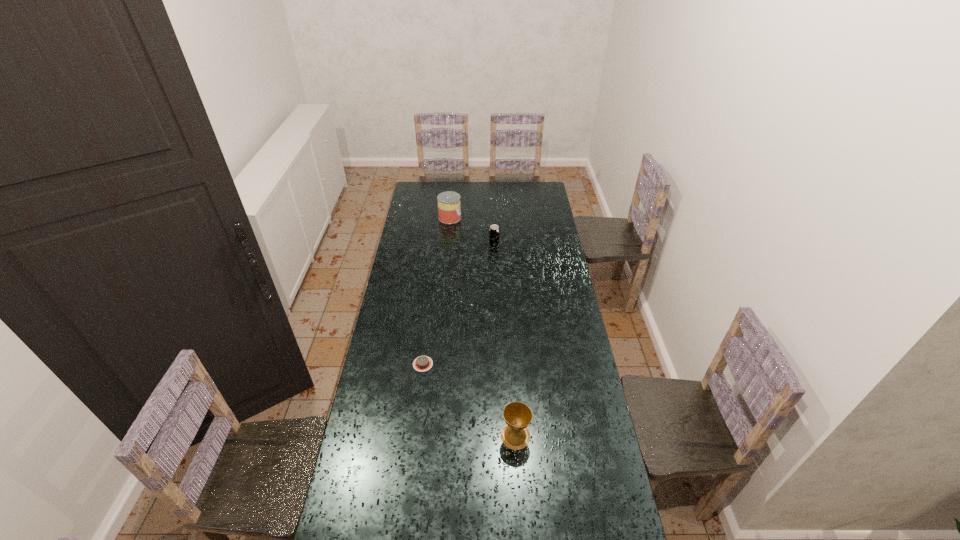
In the image, there is a desktop. What are the coordinates of `vacant space at the left edge` in the screenshot? It's located at (360, 524).

I want to click on free point at the right edge, so click(x=551, y=370).

What are the coordinates of `free space at the far right corner` in the screenshot? It's located at (529, 183).

At what (x,y) coordinates should I click in order to perform the action: click on blank region between the can and the chocolate cake. Please return your answer as a coordinate pair (x, y). This screenshot has height=540, width=960. Looking at the image, I should click on (437, 291).

Identify the location of free point between the soda can and the chalice. Image resolution: width=960 pixels, height=540 pixels. (505, 341).

The height and width of the screenshot is (540, 960). Find the location of `vacant area that lies between the can and the chalice`. vacant area that lies between the can and the chalice is located at coordinates (483, 327).

You are a GUI agent. You are given a task and a screenshot of the screen. Output one action in this format:
    pyautogui.click(x=<x>, y=<y>)
    Task: Click on the vacant space that is in between the third farthest object and the chalice
    Image resolution: width=960 pixels, height=540 pixels.
    Given the screenshot: What is the action you would take?
    pyautogui.click(x=469, y=400)

The image size is (960, 540). What are the coordinates of `empty space that is in between the chalice and the farthest object` in the screenshot? It's located at (483, 327).

The height and width of the screenshot is (540, 960). Identify the location of free area in between the chocolate cake and the third nearest object. (459, 305).

Identify the location of free spot between the farthest object and the soda can. This screenshot has height=540, width=960. (472, 232).